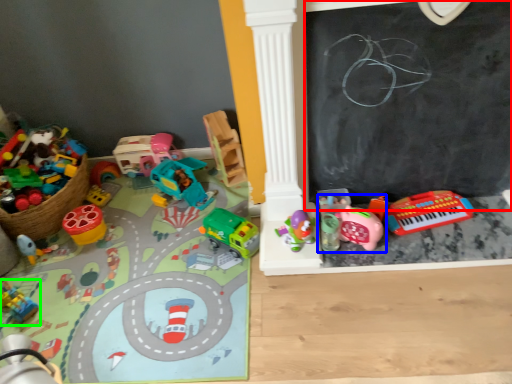
Question: Which object is positioned farthest from bulletin board (highlighted by a red box)? Select from toy (highlighted by a blue box) and toy (highlighted by a green box).

Choices:
 (A) toy
 (B) toy

Answer: (B)